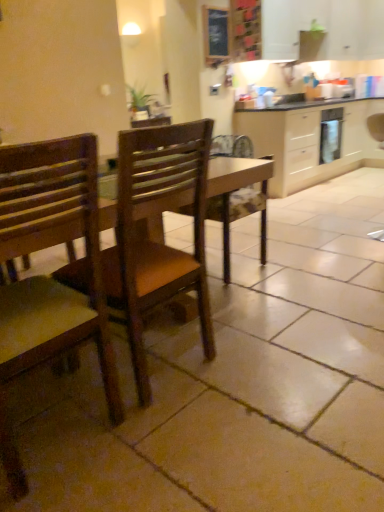
Question: Can wooden frame at upper center be found inside beige wood cabinetry at upper right?

Choices:
 (A) no
 (B) yes

Answer: (A)

Question: Is beige wood cabinetry at upper right outside of wooden frame at upper center?

Choices:
 (A) yes
 (B) no

Answer: (A)

Question: From the image's perspective, is beige wood cabinetry at upper right under wooden frame at upper center?

Choices:
 (A) yes
 (B) no

Answer: (A)

Question: Does beige wood cabinetry at upper right have a lesser width compared to wooden frame at upper center?

Choices:
 (A) no
 (B) yes

Answer: (A)

Question: Is beige wood cabinetry at upper right positioned before wooden frame at upper center?

Choices:
 (A) no
 (B) yes

Answer: (A)

Question: Is beige wood cabinetry at upper right with wooden frame at upper center?

Choices:
 (A) no
 (B) yes

Answer: (A)

Question: Is wooden chair at center, which is the 1th chair in right-to-left order, to the right of beige wood cabinetry at upper right from the viewer's perspective?

Choices:
 (A) no
 (B) yes

Answer: (A)

Question: From a real-world perspective, is wooden chair at center, the second chair positioned from the left, positioned under beige wood cabinetry at upper right based on gravity?

Choices:
 (A) no
 (B) yes

Answer: (A)

Question: From the image's perspective, does wooden chair at center, which is the 1th chair in right-to-left order, appear lower than beige wood cabinetry at upper right?

Choices:
 (A) no
 (B) yes

Answer: (B)

Question: Is wooden chair at center, which is the 1th chair in right-to-left order, smaller than beige wood cabinetry at upper right?

Choices:
 (A) no
 (B) yes

Answer: (B)

Question: Is wooden chair at center, the second chair positioned from the left, further to camera compared to beige wood cabinetry at upper right?

Choices:
 (A) no
 (B) yes

Answer: (A)

Question: Can you confirm if wooden chair at center, which is the 1th chair in right-to-left order, is thinner than beige wood cabinetry at upper right?

Choices:
 (A) no
 (B) yes

Answer: (B)

Question: Is wooden frame at upper center with beige wood cabinetry at upper right?

Choices:
 (A) yes
 (B) no

Answer: (B)